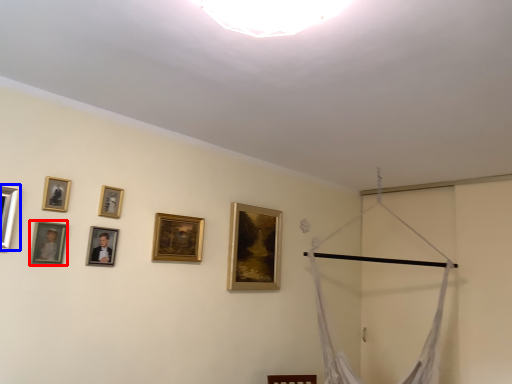
Question: Which object appears farthest to the camera in this image, picture frame (highlighted by a red box) or picture frame (highlighted by a blue box)?

Choices:
 (A) picture frame
 (B) picture frame

Answer: (A)